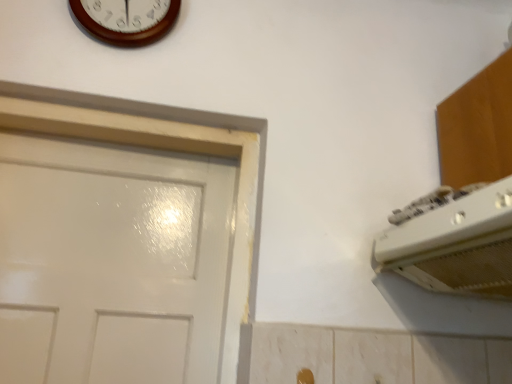
Question: Considering the relative sizes of wooden wall clock at upper center and gold metallic door handle at lower center in the image provided, is wooden wall clock at upper center thinner than gold metallic door handle at lower center?

Choices:
 (A) yes
 (B) no

Answer: (B)

Question: Is wooden wall clock at upper center oriented towards gold metallic door handle at lower center?

Choices:
 (A) no
 (B) yes

Answer: (A)

Question: Is wooden wall clock at upper center to the left of gold metallic door handle at lower center from the viewer's perspective?

Choices:
 (A) yes
 (B) no

Answer: (A)

Question: Is wooden wall clock at upper center beside gold metallic door handle at lower center?

Choices:
 (A) yes
 (B) no

Answer: (B)

Question: Is wooden wall clock at upper center outside of gold metallic door handle at lower center?

Choices:
 (A) no
 (B) yes

Answer: (B)

Question: Is white plastic air conditioner at upper right inside the boundaries of gold metallic door handle at lower center, or outside?

Choices:
 (A) outside
 (B) inside

Answer: (A)

Question: From a real-world perspective, relative to gold metallic door handle at lower center, is white plastic air conditioner at upper right vertically above or below?

Choices:
 (A) above
 (B) below

Answer: (A)

Question: Considering the relative positions of white plastic air conditioner at upper right and gold metallic door handle at lower center in the image provided, is white plastic air conditioner at upper right to the left or to the right of gold metallic door handle at lower center?

Choices:
 (A) left
 (B) right

Answer: (B)

Question: From the image's perspective, relative to gold metallic door handle at lower center, is white plastic air conditioner at upper right above or below?

Choices:
 (A) below
 (B) above

Answer: (B)

Question: Is point (464, 241) positioned closer to the camera than point (102, 36)?

Choices:
 (A) farther
 (B) closer

Answer: (B)

Question: Do you think white plastic air conditioner at upper right is within wooden wall clock at upper center, or outside of it?

Choices:
 (A) inside
 (B) outside

Answer: (B)

Question: From their relative heights in the image, would you say white plastic air conditioner at upper right is taller or shorter than wooden wall clock at upper center?

Choices:
 (A) tall
 (B) short

Answer: (B)

Question: In terms of width, does white plastic air conditioner at upper right look wider or thinner when compared to wooden wall clock at upper center?

Choices:
 (A) thin
 (B) wide

Answer: (B)

Question: From the image's perspective, relative to gold metallic door handle at lower center, is wooden wall clock at upper center above or below?

Choices:
 (A) below
 (B) above

Answer: (B)

Question: Is wooden wall clock at upper center spatially inside gold metallic door handle at lower center, or outside of it?

Choices:
 (A) outside
 (B) inside

Answer: (A)